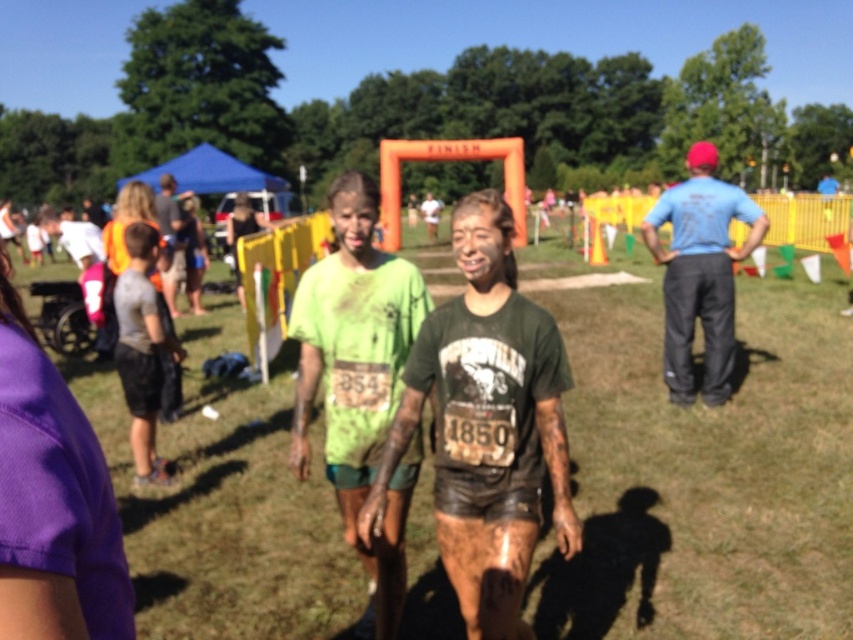
Between green matte shirt at center and blue cotton shirt at right, which one appears on the left side from the viewer's perspective?

green matte shirt at center is more to the left.

Is green matte shirt at center taller than blue cotton shirt at right?

No, green matte shirt at center is not taller than blue cotton shirt at right.

Who is more forward, (399,364) or (711,339)?

Point (399,364) is in front.

The width and height of the screenshot is (853, 640). What are the coordinates of `green matte shirt at center` in the screenshot? It's located at tap(358, 381).

Does blue cotton shirt at right appear on the left side of orange safety vest at left?

In fact, blue cotton shirt at right is to the right of orange safety vest at left.

Between point (714, 360) and point (120, 228), which one is positioned in front?

Point (714, 360)

Find the location of a particular element. blue cotton shirt at right is located at coordinates (x=700, y=273).

Based on the photo, who is positioned more to the right, purple fabric at lower left or blue cotton shirt at right?

blue cotton shirt at right is more to the right.

Identify the location of purple fabric at lower left. This screenshot has width=853, height=640. (51, 499).

Locate an element on the screen. The image size is (853, 640). purple fabric at lower left is located at coordinates (51, 499).